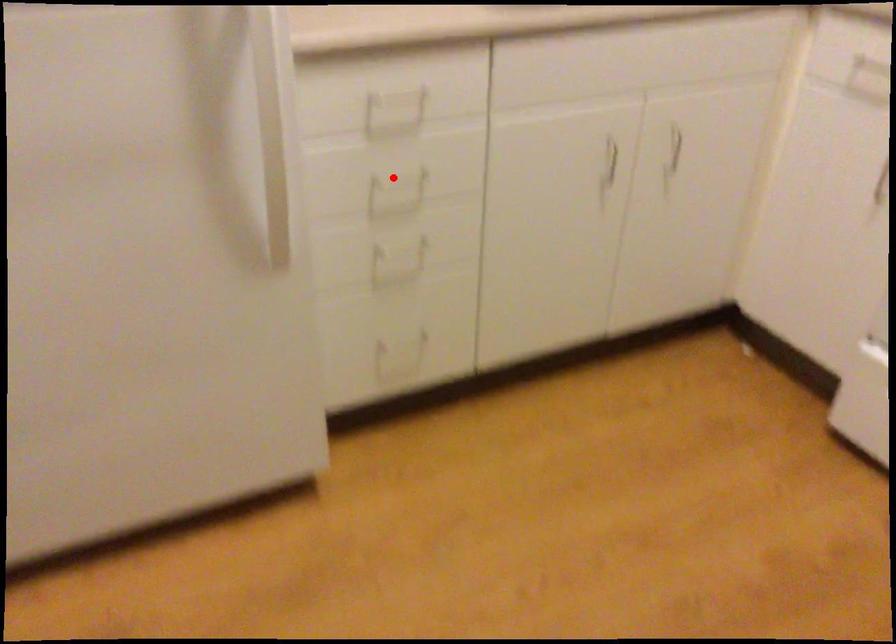
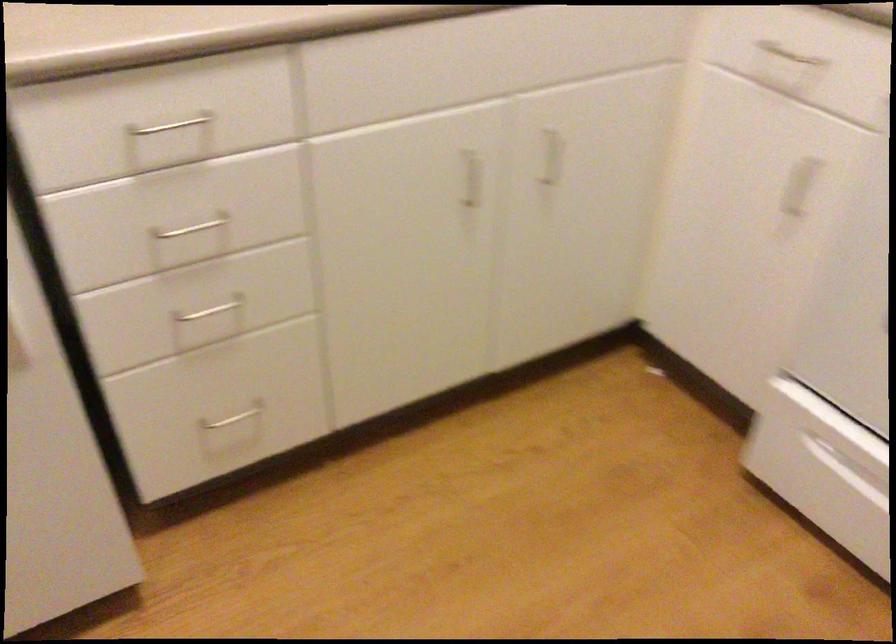
Where in the second image is the point corresponding to the highlighted location from the first image?

(192, 228)